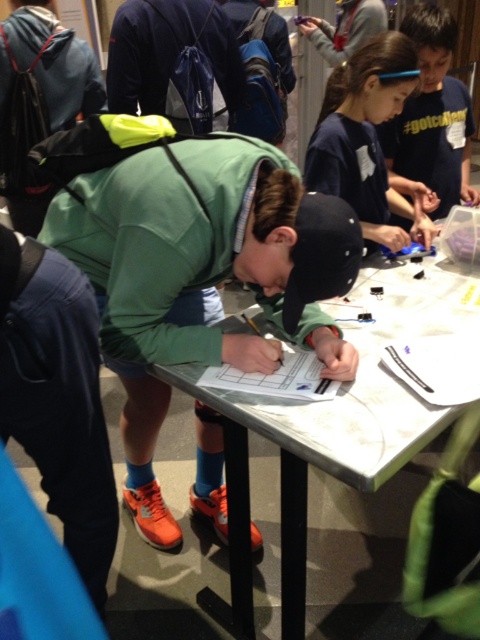
Is dark blue shirt at upper center smaller than blue cotton shirt at upper right?

Yes, dark blue shirt at upper center is smaller than blue cotton shirt at upper right.

Which is in front, point (425, 244) or point (464, 97)?

Point (425, 244) is in front.

Find the location of `dark blue shirt at upper center`. dark blue shirt at upper center is located at coordinates (367, 140).

What do you see at coordinates (192, 266) in the screenshot? I see `green matte shirt at center` at bounding box center [192, 266].

Between point (273, 184) and point (316, 186), which one is positioned in front?

Positioned in front is point (273, 184).

Find the location of a particular element. This screenshot has width=480, height=640. green matte shirt at center is located at coordinates (192, 266).

Who is taller, green matte shirt at center or blue cotton shirt at upper right?

With more height is green matte shirt at center.

Who is lower down, green matte shirt at center or blue cotton shirt at upper right?

Positioned lower is green matte shirt at center.

The image size is (480, 640). What do you see at coordinates (192, 266) in the screenshot?
I see `green matte shirt at center` at bounding box center [192, 266].

This screenshot has height=640, width=480. I want to click on green matte shirt at center, so click(192, 266).